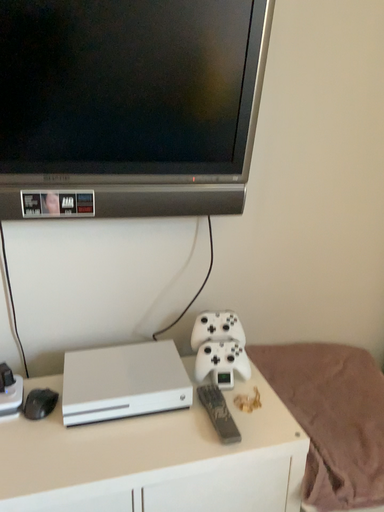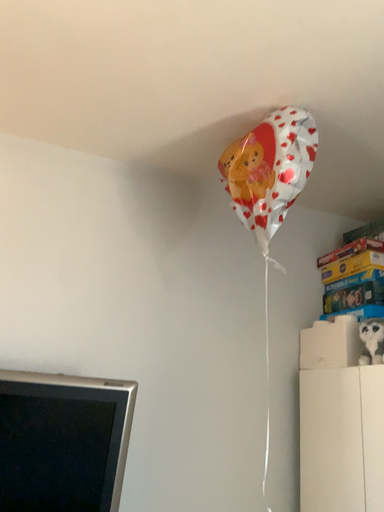
Question: Which way did the camera rotate in the video?

Choices:
 (A) rotated left
 (B) rotated right

Answer: (B)